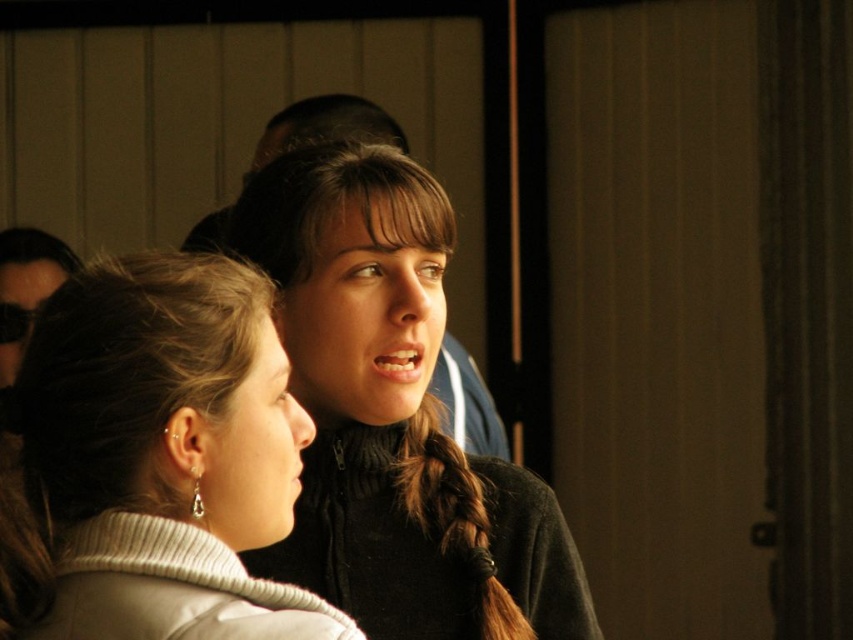
Question: Can you confirm if white matte sweater at center is thinner than brownbraided hair at center?

Choices:
 (A) no
 (B) yes

Answer: (A)

Question: Which object appears closest to the camera in this image?

Choices:
 (A) white matte sweater at center
 (B) brownbraided hair at center

Answer: (A)

Question: Can you confirm if black fuzzy sweater at center is thinner than brownbraided hair at center?

Choices:
 (A) yes
 (B) no

Answer: (B)

Question: Which is farther from the black fuzzy sweater at center?

Choices:
 (A) brownbraided hair at center
 (B) white matte sweater at center

Answer: (B)

Question: Is black fuzzy sweater at center positioned at the back of brownbraided hair at center?

Choices:
 (A) no
 (B) yes

Answer: (A)

Question: Which point appears closest to the camera in this image?

Choices:
 (A) (170, 465)
 (B) (379, 419)

Answer: (A)